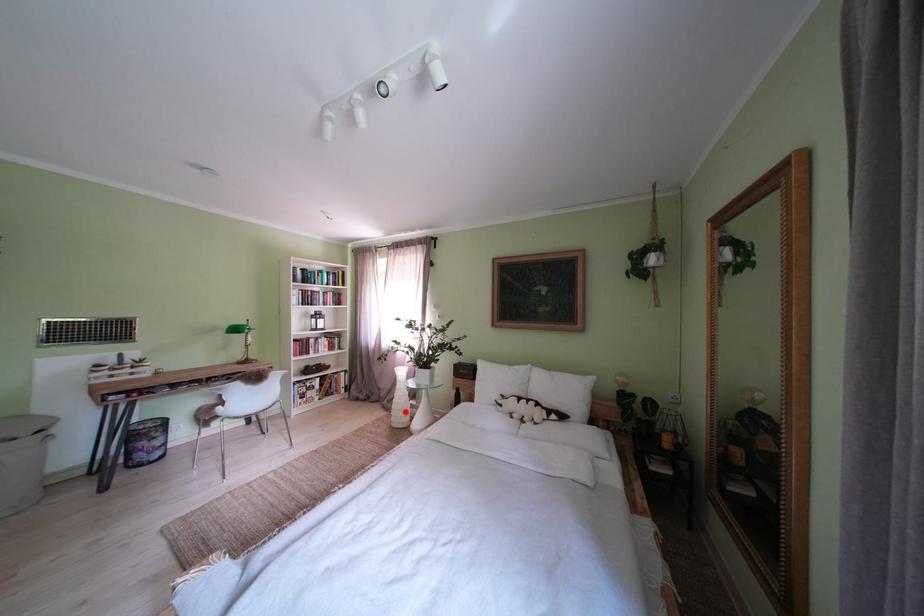
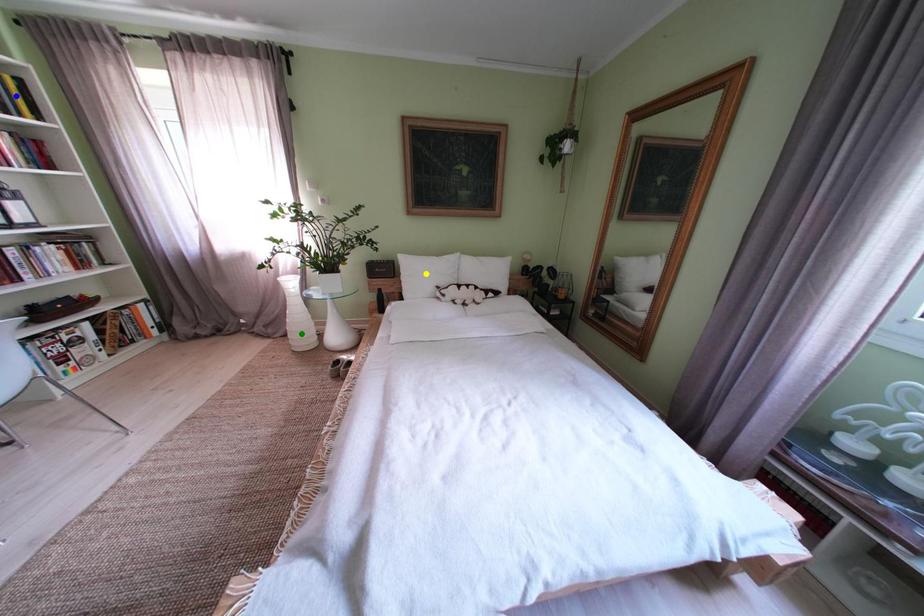
Question: I am providing you with two images of the same scene from different viewpoints. A red point is marked on the first image. You are given multiple points on the second image. In image 2, which mark is for the same physical point as the one in image 1?

Choices:
 (A) blue point
 (B) yellow point
 (C) green point

Answer: (C)